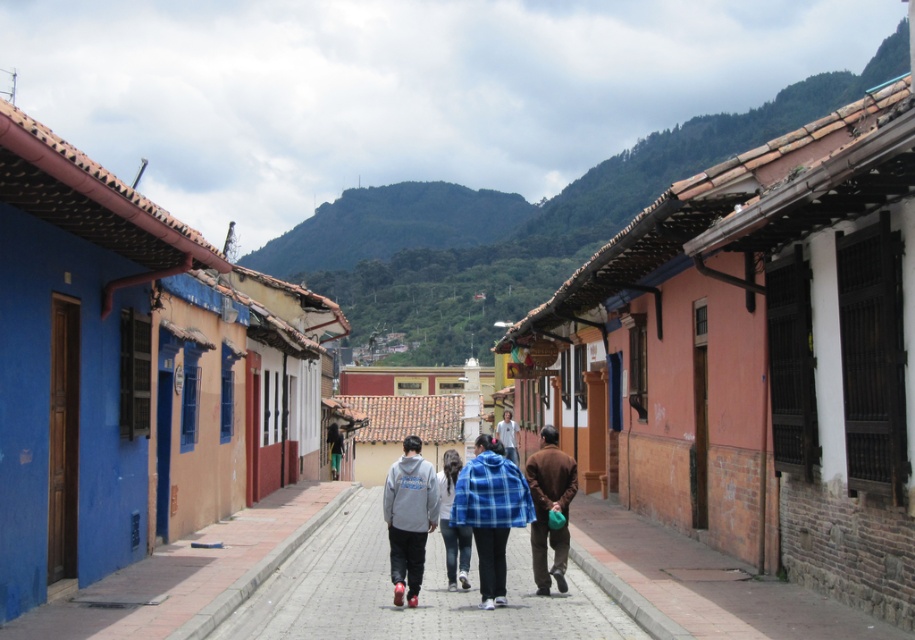
You are a painter who wants to paint a mural on the blue painted wall at lower left and the blue plaid jacket at center. Which surface has a greater width to accommodate more detailed artwork?

The blue painted wall at lower left has a greater width than the blue plaid jacket at center, so it can accommodate more detailed artwork.

Based on the photo, you are a painter who wants to paint a mural on the blue painted wall at lower left and the blue plaid jacket at center. Which surface will require more paint due to its height?

The blue painted wall at lower left will require more paint because it is much taller than the blue plaid jacket at center.